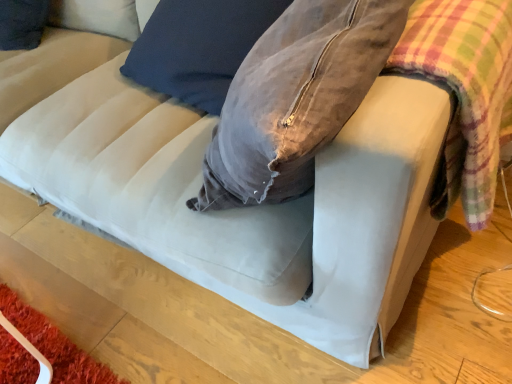
Question: Is plaid fabric at right beside velvet gray bean bag chair at center?

Choices:
 (A) no
 (B) yes

Answer: (A)

Question: Is the depth of plaid fabric at right less than that of velvet gray bean bag chair at center?

Choices:
 (A) yes
 (B) no

Answer: (A)

Question: Does plaid fabric at right have a greater width compared to velvet gray bean bag chair at center?

Choices:
 (A) no
 (B) yes

Answer: (A)

Question: Considering the relative positions of plaid fabric at right and velvet gray bean bag chair at center in the image provided, is plaid fabric at right to the left of velvet gray bean bag chair at center from the viewer's perspective?

Choices:
 (A) yes
 (B) no

Answer: (B)

Question: Does plaid fabric at right have a lesser height compared to velvet gray bean bag chair at center?

Choices:
 (A) no
 (B) yes

Answer: (B)

Question: Are plaid fabric at right and velvet gray bean bag chair at center located far from each other?

Choices:
 (A) yes
 (B) no

Answer: (B)

Question: Is velvet gray bean bag chair at center closer to camera compared to plaid fabric at right?

Choices:
 (A) yes
 (B) no

Answer: (B)

Question: Is velvet gray bean bag chair at center thinner than plaid fabric at right?

Choices:
 (A) yes
 (B) no

Answer: (B)

Question: Is velvet gray bean bag chair at center shorter than plaid fabric at right?

Choices:
 (A) yes
 (B) no

Answer: (B)

Question: Is velvet gray bean bag chair at center not near plaid fabric at right?

Choices:
 (A) yes
 (B) no

Answer: (B)

Question: From the image's perspective, does velvet gray bean bag chair at center appear higher than plaid fabric at right?

Choices:
 (A) yes
 (B) no

Answer: (A)

Question: Can you confirm if velvet gray bean bag chair at center is bigger than plaid fabric at right?

Choices:
 (A) yes
 (B) no

Answer: (A)

Question: Is plaid fabric at right situated inside velvet gray bean bag chair at center or outside?

Choices:
 (A) inside
 (B) outside

Answer: (B)